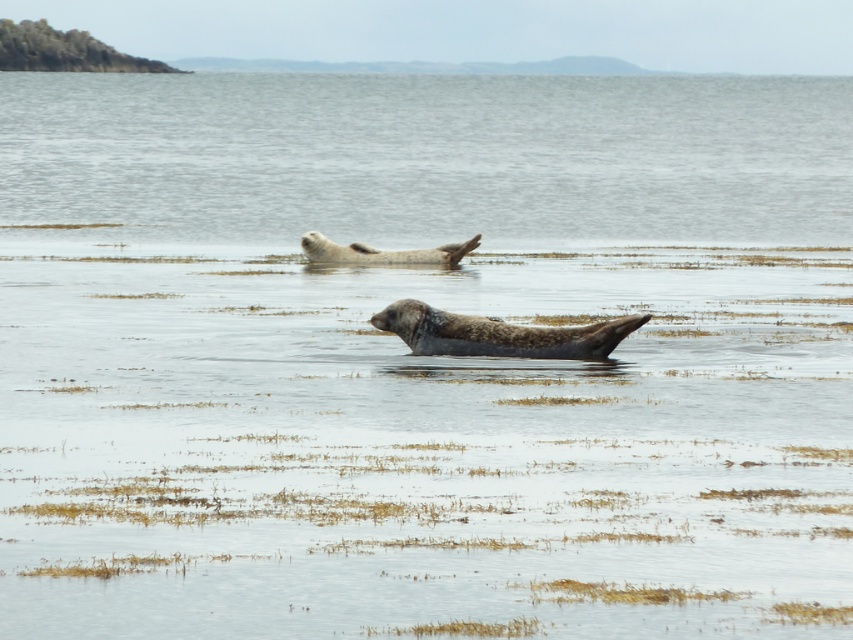
You are a wildlife photographer observing the two seals in the coastal scene. You want to capture a photo where the speckled fur seal at center and gray fur seal at center are both visible. Given their sizes, which seal will appear bigger in the photo?

The speckled fur seal at center will appear bigger in the photo because it has a larger size compared to the gray fur seal at center.

You are standing at the point marked by the coordinates point (422,323) in the coastal scene. You want to walk directly towards the viewer. How far will you have to walk to reach the viewer?

The distance between point (422,323) and the viewer is 16.42 meters, so you will have to walk 16.42 meters to reach the viewer.

You are a wildlife photographer planning to capture both the speckled fur seal at center and the gray fur seal at center in a single frame. Given that your camera has a fixed focal length, which seal should you position closer to the center of the frame to ensure both fit without cropping?

Since the speckled fur seal at center is narrower than the gray fur seal at center, positioning the speckled fur seal at center closer to the center of the frame will allow both seals to fit without cropping.